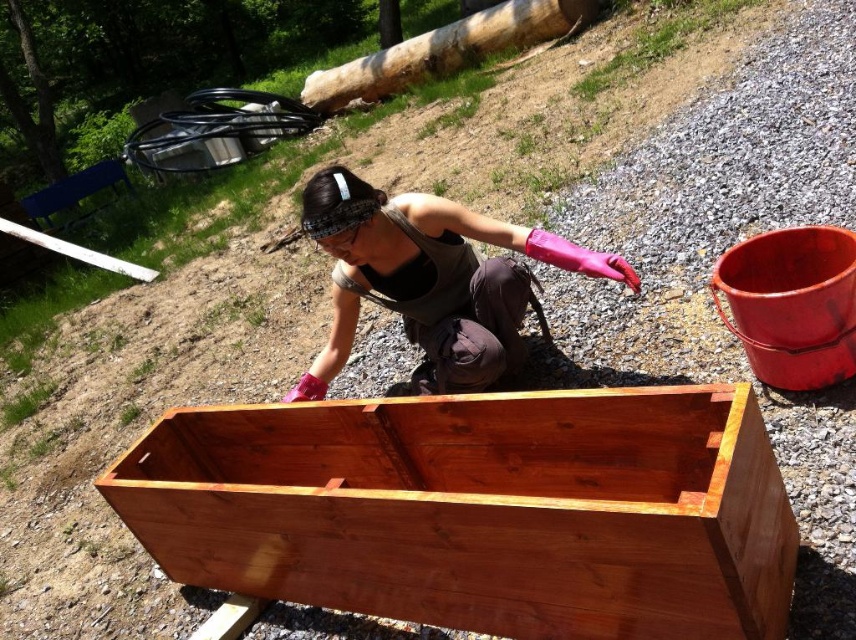
You are standing at the center of the image. There is a point labeled as point (479,509). What object is located at that point?

The shiny brown wood crate at center is located at point (479,509).

You are a delivery person who needs to place a new package on the shiny brown wood crate at center. Based on the scene description, can you confirm if there is enough space around the crate to safely place the package?

The shiny brown wood crate at center is located at point (479, 509). Since the coordinates indicate it is centrally positioned, there should be adequate space around it to safely place the package.

You are a delivery person who needs to place a heavy box onto a truck. You are currently standing near the shiny brown wood crate at center and the pink rubber gloves at center. The truck is parked 25 inches away from your current position. Can you reach the truck without moving either object?

The distance between the shiny brown wood crate at center and the pink rubber gloves at center is 24.97 inches. Since the truck is parked 25 inches away, you cannot reach it without moving the objects because the distance is slightly less than required.